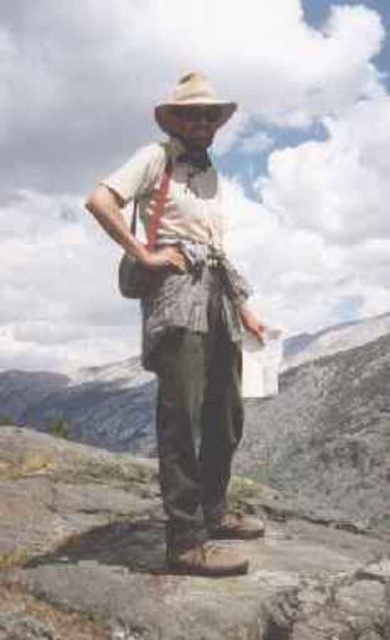
Who is taller, rocky terrain at center or light brown felt cowboy hat at center?

Standing taller between the two is rocky terrain at center.

Does point (97, 387) come farther from viewer compared to point (179, 81)?

That is True.

This screenshot has width=390, height=640. Find the location of `rocky terrain at center`. rocky terrain at center is located at coordinates (326, 426).

Is point (145, 172) closer to viewer compared to point (203, 92)?

Yes, it is in front of point (203, 92).

Which is behind, point (184, 360) or point (182, 106)?

Point (182, 106)

Locate an element on the screen. camouflage pants at center is located at coordinates click(x=187, y=321).

Where is `camouflage pants at center`? This screenshot has width=390, height=640. camouflage pants at center is located at coordinates (187, 321).

How far apart are camouflage pants at center and rocky terrain at center?

102.68 meters

The image size is (390, 640). What do you see at coordinates (187, 321) in the screenshot?
I see `camouflage pants at center` at bounding box center [187, 321].

Where is `camouflage pants at center`? camouflage pants at center is located at coordinates (187, 321).